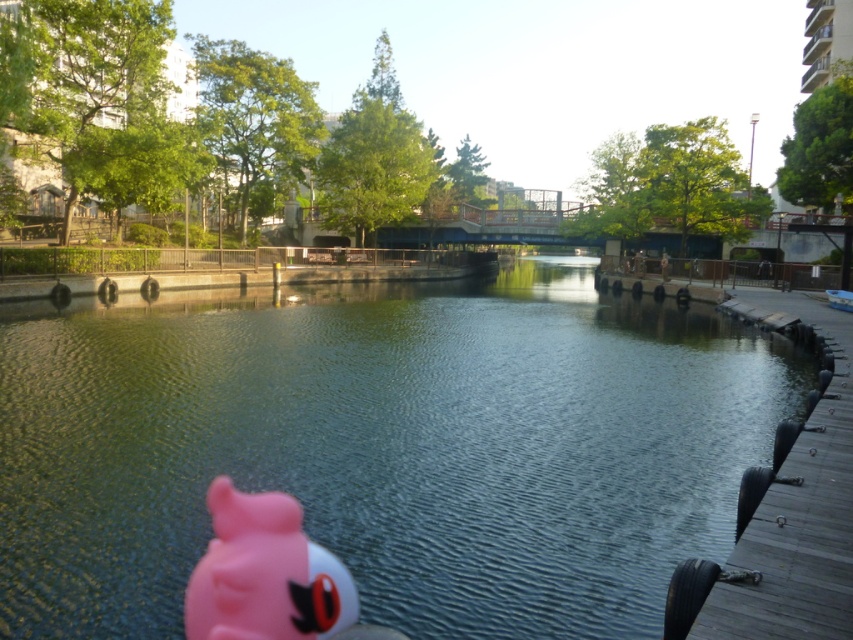
Question: Among these objects, which one is nearest to the camera?

Choices:
 (A) pink rubber toy at lower left
 (B) clear blue water at center

Answer: (A)

Question: Which point is farther to the camera?

Choices:
 (A) pink rubber toy at lower left
 (B) dark gray wooden dock at right
 (C) clear blue water at center

Answer: (C)

Question: Where is clear blue water at center located in relation to dark gray wooden dock at right in the image?

Choices:
 (A) left
 (B) right

Answer: (A)

Question: Is clear blue water at center further to the viewer compared to dark gray wooden dock at right?

Choices:
 (A) yes
 (B) no

Answer: (A)

Question: Based on their relative distances, which object is farther from the pink rubber toy at lower left?

Choices:
 (A) dark gray wooden dock at right
 (B) clear blue water at center

Answer: (B)

Question: Does clear blue water at center appear over pink rubber toy at lower left?

Choices:
 (A) no
 (B) yes

Answer: (B)